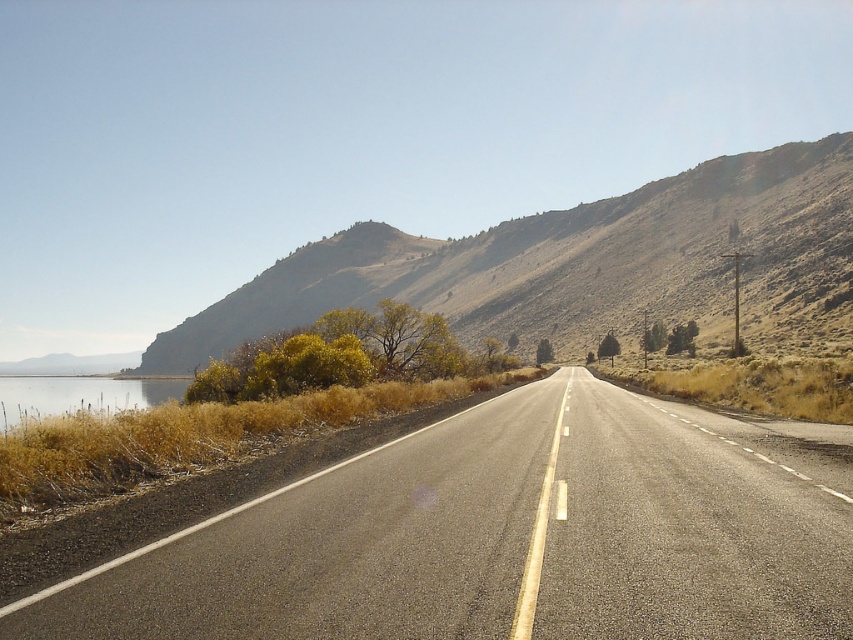
Who is lower down, asphalt road at center or dull brown hillside at upper center?

asphalt road at center is below.

Is asphalt road at center positioned at the back of dull brown hillside at upper center?

No, it is in front of dull brown hillside at upper center.

Between point (846, 564) and point (759, 198), which one is positioned in front?

Positioned in front is point (846, 564).

Where is `asphalt road at center`? This screenshot has width=853, height=640. asphalt road at center is located at coordinates (503, 538).

Does dull brown hillside at upper center have a greater height compared to clear water at left?

Indeed, dull brown hillside at upper center has a greater height compared to clear water at left.

Who is taller, dull brown hillside at upper center or clear water at left?

Standing taller between the two is dull brown hillside at upper center.

Who is more distant from viewer, (448, 305) or (9, 419)?

Point (448, 305)

You are a GUI agent. You are given a task and a screenshot of the screen. Output one action in this format:
    pyautogui.click(x=<x>, y=<y>)
    Task: Click on the dull brown hillside at upper center
    The height and width of the screenshot is (640, 853).
    Given the screenshot: What is the action you would take?
    pyautogui.click(x=555, y=259)

Can you confirm if asphalt road at center is positioned to the right of clear water at left?

Yes, asphalt road at center is to the right of clear water at left.

Is asphalt road at center wider than clear water at left?

Incorrect, asphalt road at center's width does not surpass clear water at left's.

Between point (305, 586) and point (3, 417), which one is positioned behind?

The point (3, 417) is behind.

Find the location of `asphalt road at center`. asphalt road at center is located at coordinates (503, 538).